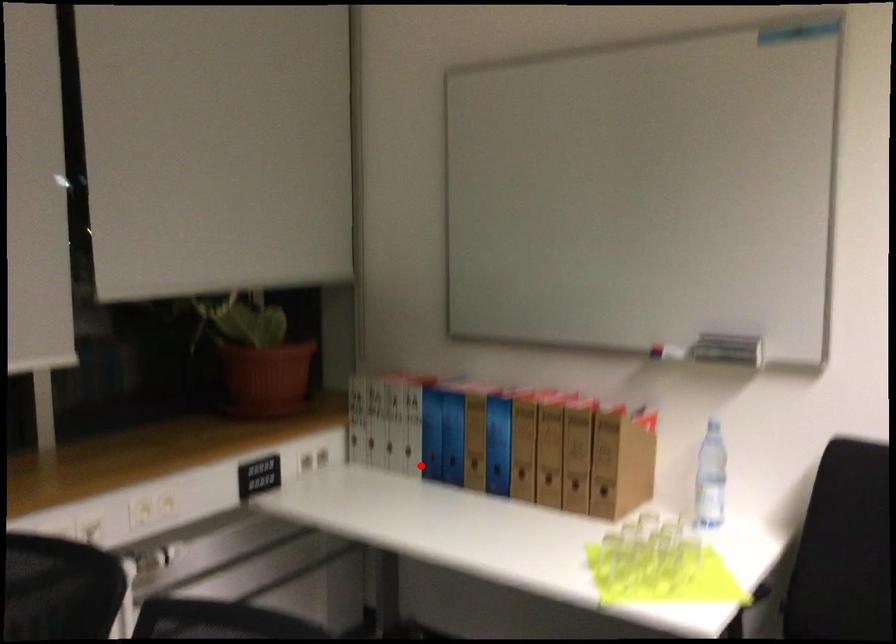
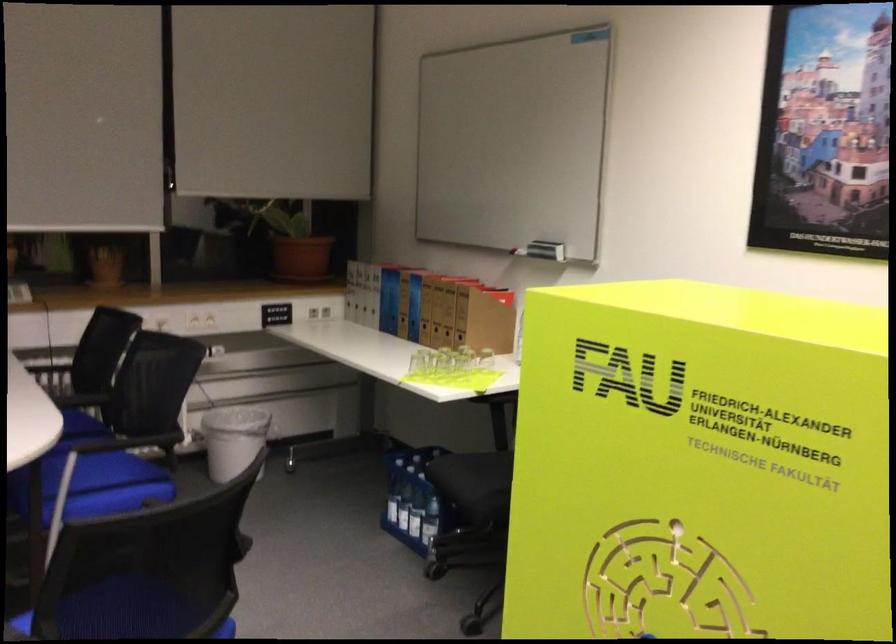
Question: I am providing you with two images of the same scene from different viewpoints. A red point is shown in image1. For the corresponding object point in image2, is it positioned nearer or farther from the camera?

Choices:
 (A) Nearer
 (B) Farther

Answer: (B)